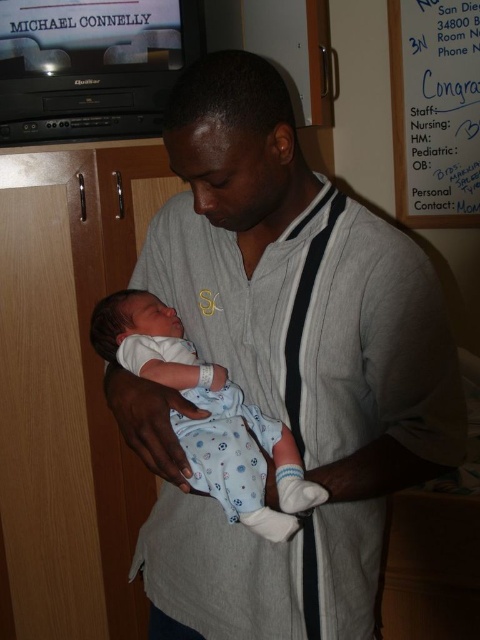
You are a nurse in the hospital room. You need to determine which clothing item is bigger between the gray cotton shirt at center and the blue cotton onesie at center. Which one is larger?

The gray cotton shirt at center has a larger size compared to the blue cotton onesie at center, so the gray cotton shirt at center is larger.

Please describe the object located at the coordinates point (284, 365) in the image.

The gray cotton shirt at center is located at point (284, 365).